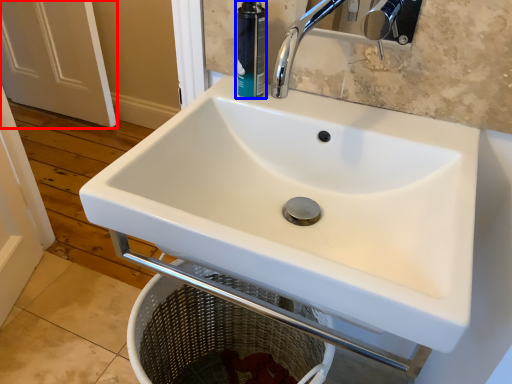
Question: Which point is closer to the camera, screen door (highlighted by a red box) or toiletry (highlighted by a blue box)?

Choices:
 (A) screen door
 (B) toiletry

Answer: (B)